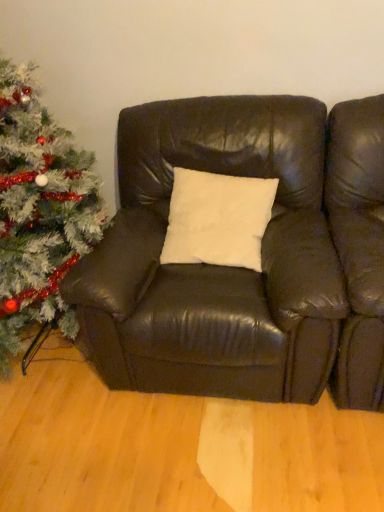
Question: From the image's perspective, is matte brown leather couch at center below white glittery christmas tree at left?

Choices:
 (A) no
 (B) yes

Answer: (B)

Question: Considering the relative sizes of matte brown leather couch at center and white glittery christmas tree at left in the image provided, is matte brown leather couch at center wider than white glittery christmas tree at left?

Choices:
 (A) no
 (B) yes

Answer: (B)

Question: Is matte brown leather couch at center far from white glittery christmas tree at left?

Choices:
 (A) yes
 (B) no

Answer: (B)

Question: Considering the relative positions of matte brown leather couch at center and white glittery christmas tree at left in the image provided, is matte brown leather couch at center to the right of white glittery christmas tree at left from the viewer's perspective?

Choices:
 (A) no
 (B) yes

Answer: (B)

Question: Is matte brown leather couch at center looking in the opposite direction of white glittery christmas tree at left?

Choices:
 (A) no
 (B) yes

Answer: (A)

Question: Does matte brown leather couch at center appear on the left side of white glittery christmas tree at left?

Choices:
 (A) yes
 (B) no

Answer: (B)

Question: From the image's perspective, is white glittery christmas tree at left below matte brown leather couch at center?

Choices:
 (A) no
 (B) yes

Answer: (A)

Question: Can you confirm if white glittery christmas tree at left is bigger than matte brown leather couch at center?

Choices:
 (A) yes
 (B) no

Answer: (A)

Question: Considering the relative sizes of white glittery christmas tree at left and matte brown leather couch at center in the image provided, is white glittery christmas tree at left taller than matte brown leather couch at center?

Choices:
 (A) no
 (B) yes

Answer: (B)

Question: Is white glittery christmas tree at left thinner than matte brown leather couch at center?

Choices:
 (A) no
 (B) yes

Answer: (B)

Question: Is matte brown leather couch at center at the back of white glittery christmas tree at left?

Choices:
 (A) no
 (B) yes

Answer: (A)

Question: Is white glittery christmas tree at left positioned before matte brown leather couch at center?

Choices:
 (A) yes
 (B) no

Answer: (A)

Question: From the image's perspective, is matte brown leather couch at center positioned above or below white glittery christmas tree at left?

Choices:
 (A) above
 (B) below

Answer: (B)